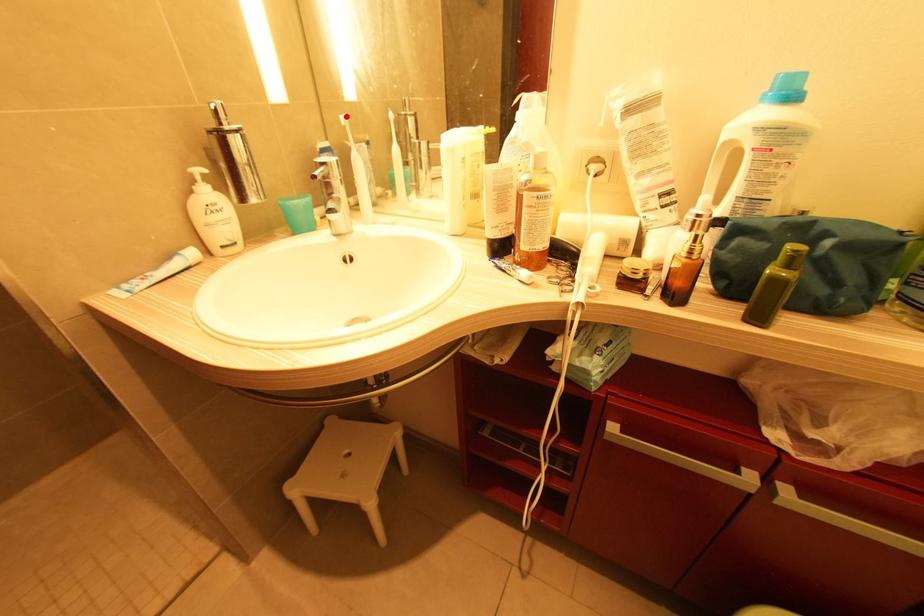
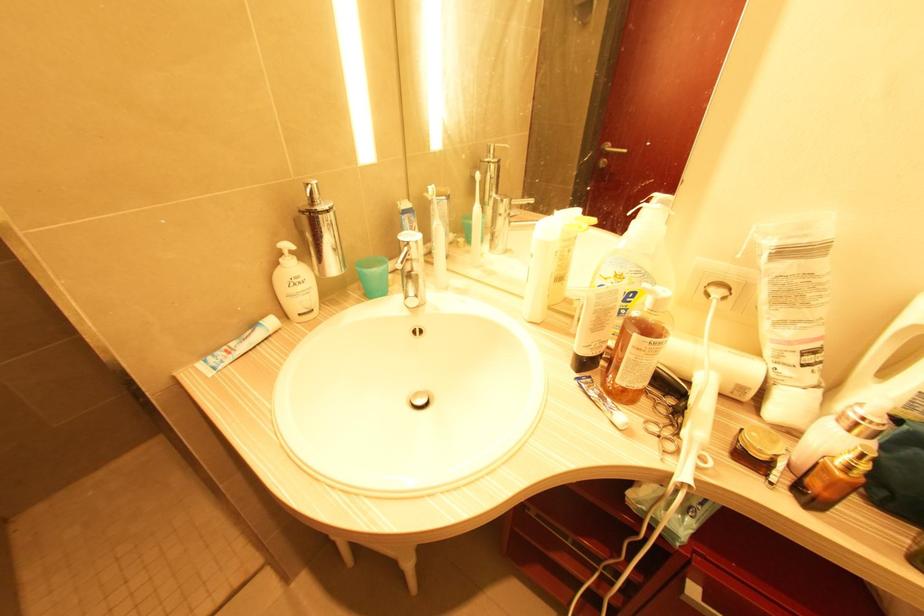
In the second image, find the point that corresponds to the highlighted location in the first image.

(434, 187)